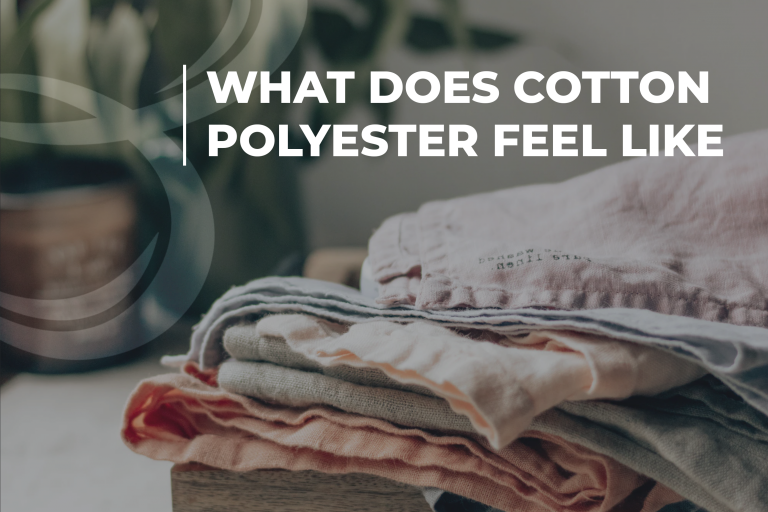
This screenshot has height=512, width=768. What are the coordinates of `white countertop` in the screenshot? It's located at (80, 453).